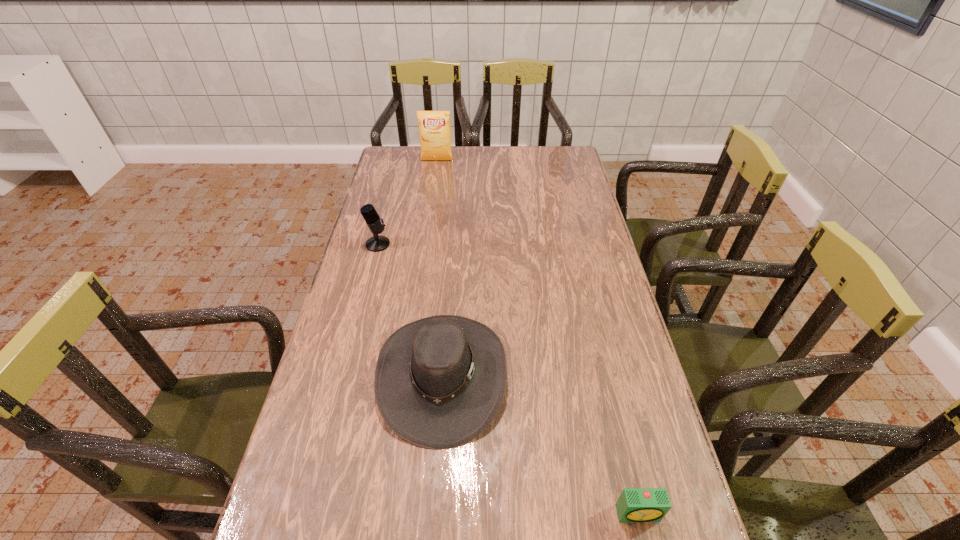
You are a GUI agent. You are given a task and a screenshot of the screen. Output one action in this format:
    pyautogui.click(x=<x>, y=<y>)
    Task: Click on the object that is the third nearest to the rightmost object
    The image size is (960, 540).
    Given the screenshot: What is the action you would take?
    pyautogui.click(x=434, y=126)

Locate which object ranks in proximity to the crisp (potato chip). Please provide its 2D coordinates. Your answer should be formatted as a tuple, i.e. [(x, y)], where the tuple contains the x and y coordinates of a point satisfying the conditions above.

[(377, 243)]

Where is `free space that satisfies the following two spatial constraints: 1. on the front of the farthest object with the logo; 2. on the stand of the second farthest object`? This screenshot has height=540, width=960. free space that satisfies the following two spatial constraints: 1. on the front of the farthest object with the logo; 2. on the stand of the second farthest object is located at coordinates (425, 244).

Where is `free space that satisfies the following two spatial constraints: 1. on the front of the farthest object with the logo; 2. on the stand of the microphone`? The height and width of the screenshot is (540, 960). free space that satisfies the following two spatial constraints: 1. on the front of the farthest object with the logo; 2. on the stand of the microphone is located at coordinates (425, 244).

The width and height of the screenshot is (960, 540). Find the location of `free space that satisfies the following two spatial constraints: 1. on the front of the farthest object with the logo; 2. on the stand of the leftmost object`. free space that satisfies the following two spatial constraints: 1. on the front of the farthest object with the logo; 2. on the stand of the leftmost object is located at coordinates (425, 244).